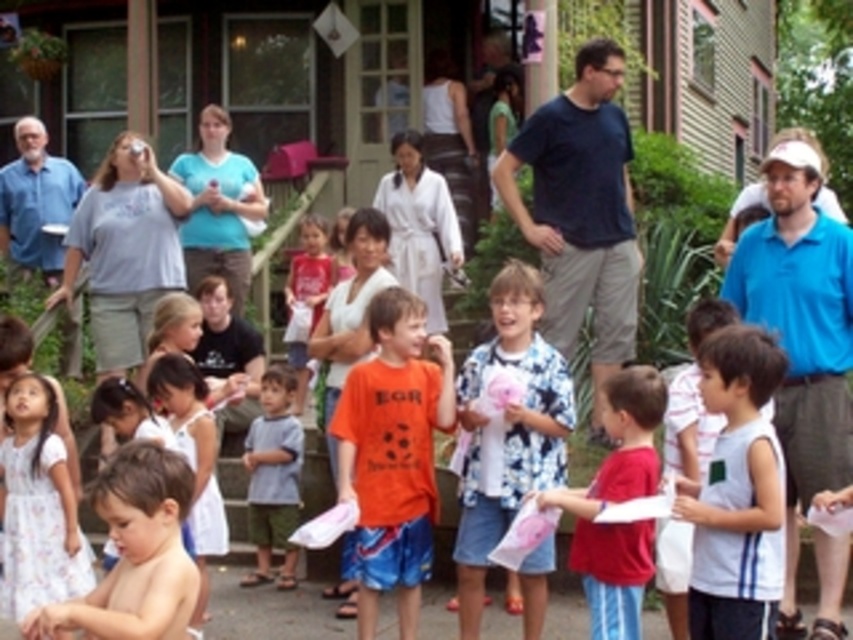
Can you confirm if orange cotton shirt at center is shorter than gray cotton shirt at center?

Indeed, orange cotton shirt at center has a lesser height compared to gray cotton shirt at center.

Which is more to the right, orange cotton shirt at center or gray cotton shirt at center?

orange cotton shirt at center

Is point (405, 448) farther from viewer compared to point (251, 429)?

No, it is not.

This screenshot has width=853, height=640. Identify the location of orange cotton shirt at center. (393, 452).

Is point (695, 592) farther from viewer compared to point (265, 444)?

That is False.

Does white sleeveless shirt at center have a greater height compared to gray cotton shirt at center?

Yes.

Which is in front, point (733, 497) or point (270, 467)?

Positioned in front is point (733, 497).

Identify the location of white sleeveless shirt at center. The image size is (853, 640). (737, 492).

Does point (477, 529) lie in front of point (22, 412)?

No, it is behind (22, 412).

How much distance is there between floral shirt at center and white floral dress at lower left?

floral shirt at center and white floral dress at lower left are 11.59 meters apart.

The image size is (853, 640). Describe the element at coordinates (508, 429) in the screenshot. I see `floral shirt at center` at that location.

Identify the location of floral shirt at center. The image size is (853, 640). (508, 429).